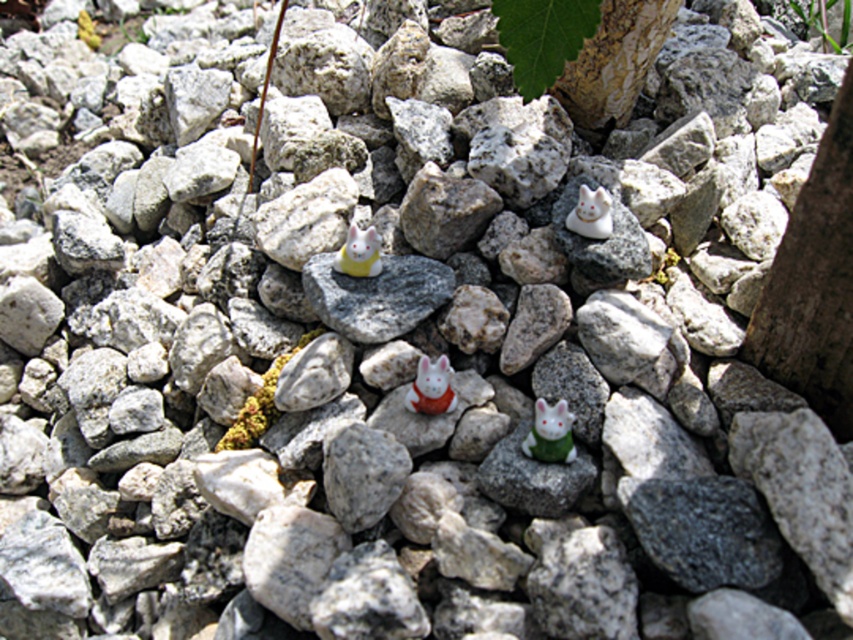
At what (x,y) coordinates should I click in order to perform the action: click on white glossy rabbit at center. Please return your answer as a coordinate pair (x, y). The width and height of the screenshot is (853, 640). Looking at the image, I should click on (431, 387).

Which is more to the right, white glossy rabbit at center or green leafy plant at upper center?

green leafy plant at upper center

Who is more distant from viewer, (421, 364) or (798, 6)?

Positioned behind is point (798, 6).

Where is `white glossy rabbit at center`? white glossy rabbit at center is located at coordinates (431, 387).

Does green matte rabbit at center have a lesser width compared to green leafy plant at upper center?

Yes, green matte rabbit at center is thinner than green leafy plant at upper center.

Which is more to the right, green matte rabbit at center or green leafy plant at upper center?

From the viewer's perspective, green leafy plant at upper center appears more on the right side.

Locate an element on the screen. green matte rabbit at center is located at coordinates (550, 433).

Is green matte rabbit at center thinner than white glossy rabbit at center?

In fact, green matte rabbit at center might be wider than white glossy rabbit at center.

Between point (548, 445) and point (421, 388), which one is positioned in front?

Positioned in front is point (548, 445).

Locate an element on the screen. green matte rabbit at center is located at coordinates (550, 433).